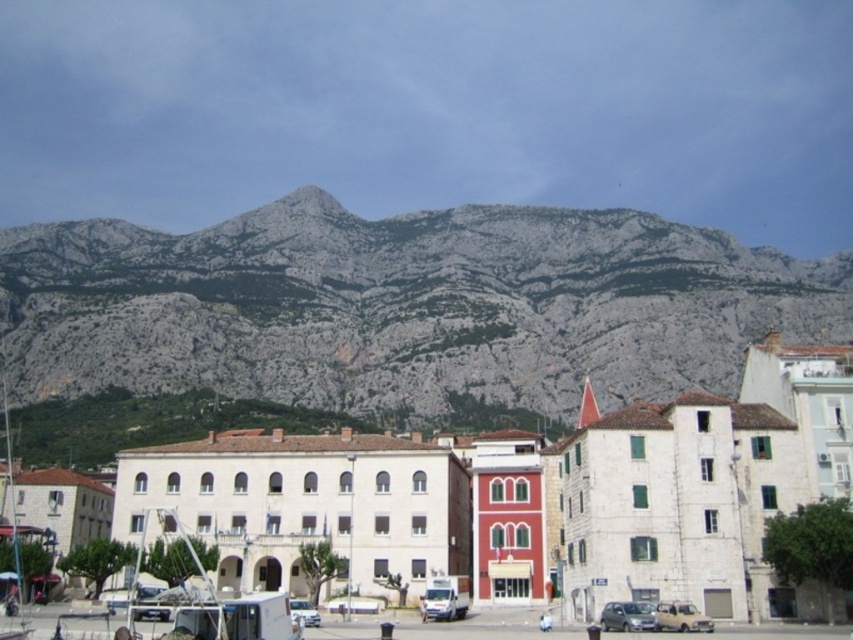
You are standing on the street in this urban landscape and want to walk from the point at coordinates point (206,483) to the point at coordinates point (628,604). Which direction should you face to move towards the second point?

Since point (206,483) is closer to you than point (628,604), you should face towards the direction away from you to reach point (628,604).

You are standing at the center of the image. Which direction should you look to see the white stone buildings at center?

The white stone buildings at center are located at point coordinates of [668,492], so you should look directly ahead since they are centered in the image.

You are a delivery driver who needs to park your white matte van at center in a spot that allows you to see the gray rock mountain at upper center. Based on the scene, can you park your van in a position where the mountain remains visible from your parking spot?

The gray rock mountain at upper center is located above the white matte van at center, so yes, you can park the van in a position where the mountain remains visible from your parking spot because the mountain is positioned above the van in the scene.